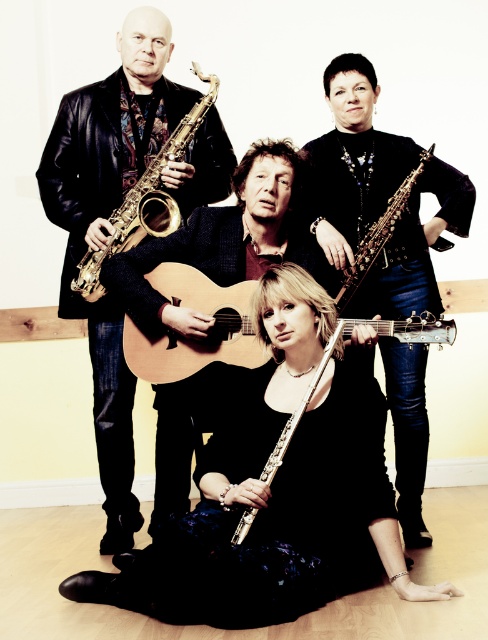
Between gold metallic saxophone at left and shiny silver flute at lower center, which one appears on the right side from the viewer's perspective?

shiny silver flute at lower center is more to the right.

Which of these two, gold metallic saxophone at left or shiny silver flute at lower center, stands taller?

gold metallic saxophone at left

Who is more distant from viewer, (170, 198) or (406, 572)?

The point (170, 198) is more distant.

At what (x,y) coordinates should I click in order to perform the action: click on gold metallic saxophone at left. Please return your answer as a coordinate pair (x, y). The width and height of the screenshot is (488, 640). Looking at the image, I should click on (145, 198).

Based on the photo, is shiny black leather jacket at left thinner than gold metallic saxophone at left?

In fact, shiny black leather jacket at left might be wider than gold metallic saxophone at left.

Which is in front, point (166, 84) or point (162, 189)?

Positioned in front is point (162, 189).

This screenshot has width=488, height=640. What do you see at coordinates (108, 225) in the screenshot?
I see `shiny black leather jacket at left` at bounding box center [108, 225].

Where is `shiny black leather jacket at left`? This screenshot has width=488, height=640. shiny black leather jacket at left is located at coordinates (108, 225).

The width and height of the screenshot is (488, 640). What are the coordinates of `shiny silver flute at center` in the screenshot? It's located at (273, 488).

The image size is (488, 640). In order to click on shiny silver flute at center in this screenshot , I will do `click(273, 488)`.

What are the coordinates of `shiny silver flute at center` in the screenshot? It's located at (273, 488).